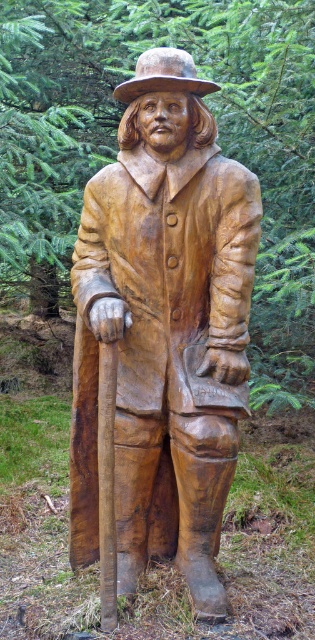
Is wooden statue at center to the left of wooden textured hat at center from the viewer's perspective?

Indeed, wooden statue at center is positioned on the left side of wooden textured hat at center.

Is wooden statue at center thinner than wooden textured hat at center?

Incorrect, wooden statue at center's width is not less than wooden textured hat at center's.

This screenshot has width=315, height=640. I want to click on wooden statue at center, so click(x=164, y=328).

Where is `wooden statue at center`? The height and width of the screenshot is (640, 315). wooden statue at center is located at coordinates (164, 328).